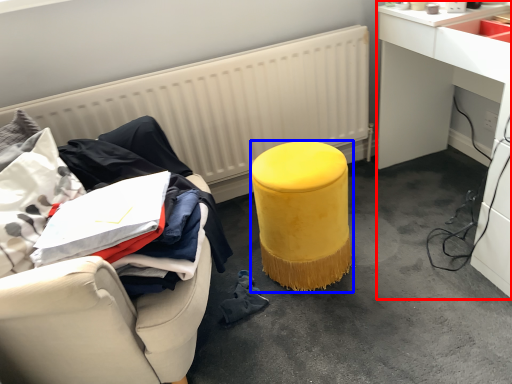
Question: Which object appears farthest to the camera in this image, desk (highlighted by a red box) or stool (highlighted by a blue box)?

Choices:
 (A) desk
 (B) stool

Answer: (B)